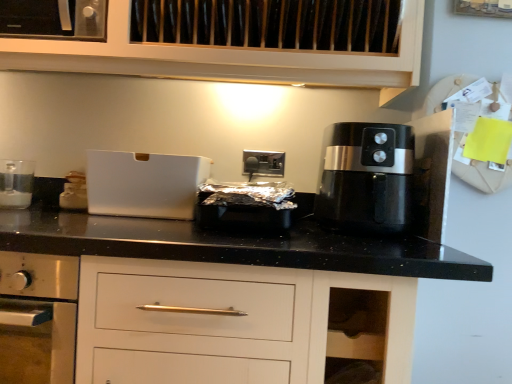
Question: From the image's perspective, is black plastic air fryer at right located above or below clear glass at left, arranged as the second kitchen appliance when viewed from the right?

Choices:
 (A) above
 (B) below

Answer: (A)

Question: Considering the positions of black plastic air fryer at right and clear glass at left, which is counted as the first kitchen appliance, starting from the left, in the image, is black plastic air fryer at right bigger or smaller than clear glass at left, which is counted as the first kitchen appliance, starting from the left,?

Choices:
 (A) big
 (B) small

Answer: (A)

Question: Estimate the real-world distances between objects in this image. Which object is closer to the satin silver outlet at center?

Choices:
 (A) white matte bread box at left, which is the 2th kitchen appliance in left-to-right order
 (B) clear glass at left, which is counted as the first kitchen appliance, starting from the left
 (C) black plastic air fryer at right
 (D) white matte box at center

Answer: (D)

Question: Estimate the real-world distances between objects in this image. Which object is farther from the white matte bread box at left, which is the 2th kitchen appliance in left-to-right order?

Choices:
 (A) satin silver outlet at center
 (B) white matte box at center
 (C) black plastic air fryer at right
 (D) clear glass at left, arranged as the second kitchen appliance when viewed from the right

Answer: (C)